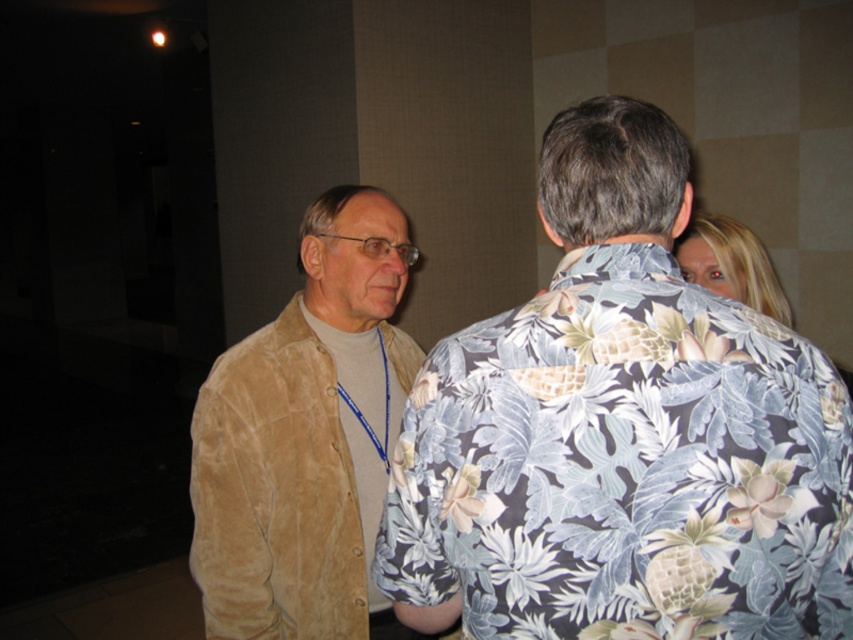
Question: Can you confirm if suede jacket at left is positioned above blonde hair at upper right?

Choices:
 (A) no
 (B) yes

Answer: (A)

Question: Which object is positioned farthest from the blonde hair at upper right?

Choices:
 (A) suede jacket at left
 (B) floral print shirt at center

Answer: (B)

Question: Does floral print shirt at center appear under suede jacket at left?

Choices:
 (A) yes
 (B) no

Answer: (B)

Question: Does floral print shirt at center appear over blonde hair at upper right?

Choices:
 (A) no
 (B) yes

Answer: (A)

Question: Which point is closer to the camera?

Choices:
 (A) floral print shirt at center
 (B) suede jacket at left
 (C) blonde hair at upper right

Answer: (A)

Question: Which object is positioned closest to the suede jacket at left?

Choices:
 (A) blonde hair at upper right
 (B) floral print shirt at center

Answer: (B)